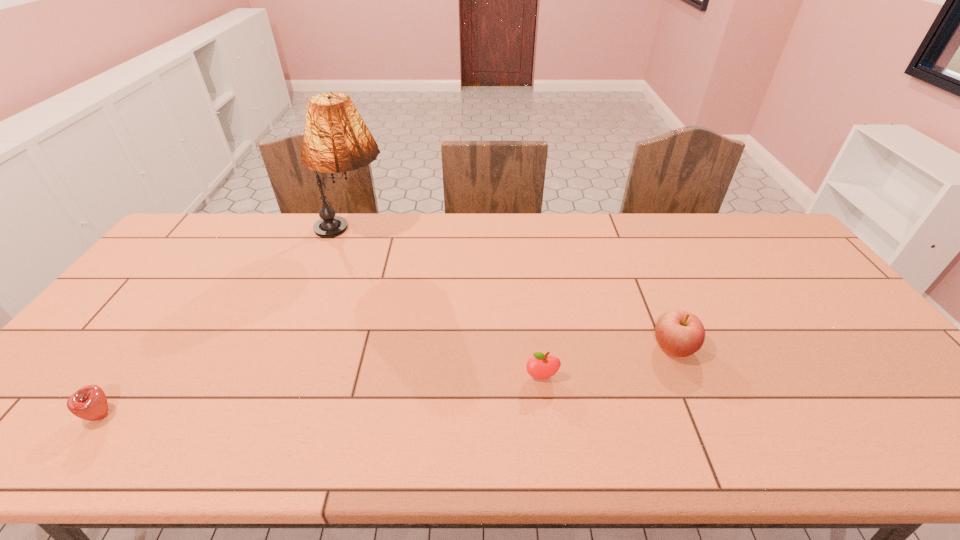
Locate an element on the screen. This screenshot has height=540, width=960. vacant region at the far right corner is located at coordinates (770, 248).

Identify the location of vacant space that's between the second tallest object and the second object from right to left. (608, 362).

Where is `empty location between the nearest object and the second nearest apple`? empty location between the nearest object and the second nearest apple is located at coordinates (322, 396).

The image size is (960, 540). I want to click on unoccupied area between the second object from right to left and the nearest object, so click(322, 396).

Locate an element on the screen. Image resolution: width=960 pixels, height=540 pixels. free spot between the second tallest object and the nearest apple is located at coordinates (387, 381).

Locate an element on the screen. The image size is (960, 540). free spot between the second farthest object and the leftmost apple is located at coordinates (387, 381).

Where is `free space between the second apple from right to left and the tallest apple`? This screenshot has width=960, height=540. free space between the second apple from right to left and the tallest apple is located at coordinates (608, 362).

This screenshot has height=540, width=960. I want to click on vacant area that lies between the farthest apple and the leftmost apple, so click(x=387, y=381).

Where is `free space that is in between the second farthest apple and the tallest object`? The width and height of the screenshot is (960, 540). free space that is in between the second farthest apple and the tallest object is located at coordinates (447, 305).

I want to click on blank region between the nearest object and the second apple from right to left, so click(322, 396).